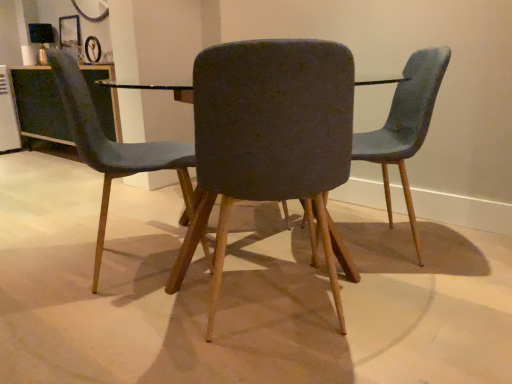
Identify the location of vacant space to the left of textured gray chair at center, which is the second chair from right to left. Image resolution: width=512 pixels, height=384 pixels. (130, 328).